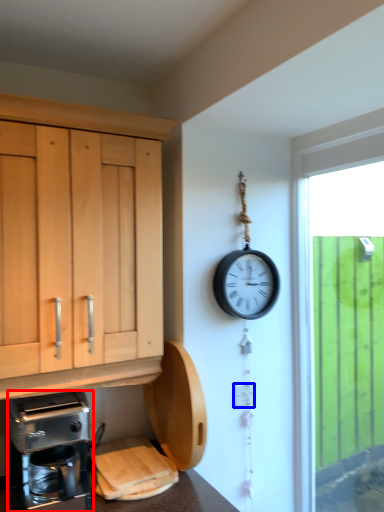
Question: Which point is closer to the camera, coffee maker (highlighted by a red box) or electric outlet (highlighted by a blue box)?

Choices:
 (A) coffee maker
 (B) electric outlet

Answer: (A)